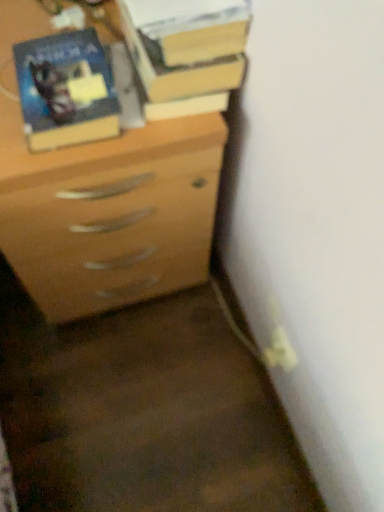
You are a GUI agent. You are given a task and a screenshot of the screen. Output one action in this format:
    pyautogui.click(x=<x>, y=<y>)
    Task: Click on the free space to the left of hardcover book at upper center
    The height and width of the screenshot is (512, 384).
    Given the screenshot: What is the action you would take?
    pyautogui.click(x=64, y=34)